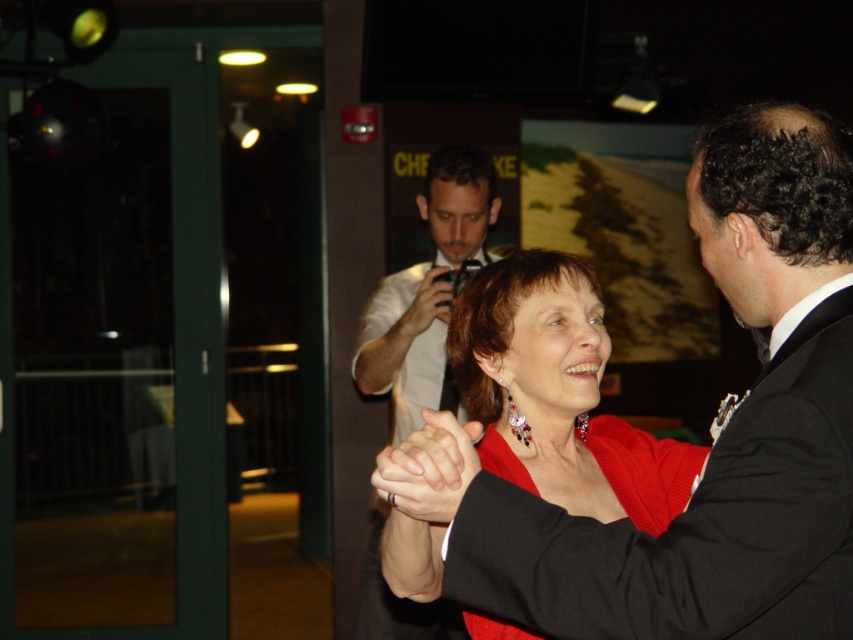
You are standing at the point labeled point (x=398, y=358) and want to move to the point labeled point (x=606, y=508). Which direction should you move to get closer to the camera?

To move from point (x=398, y=358) to point (x=606, y=508), you should move forward because point (x=606, y=508) is closer to the camera than point (x=398, y=358).

You are at the entrance of the event and want to find the matte red dress at center. According to the coordinates provided, in which direction should you move from your current position to locate it?

The matte red dress at center is located at coordinates point (556, 394). Since the coordinate system typically places the origin at the bottom left corner, moving towards the upper right direction from the entrance would help locate it.